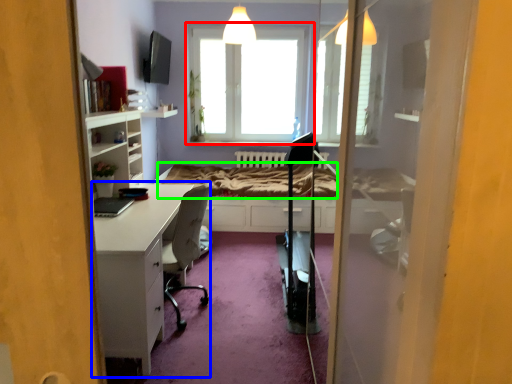
Question: Considering the real-world distances, which object is farthest from window (highlighted by a red box)? desk (highlighted by a blue box) or bed frame (highlighted by a green box)?

Choices:
 (A) desk
 (B) bed frame

Answer: (A)